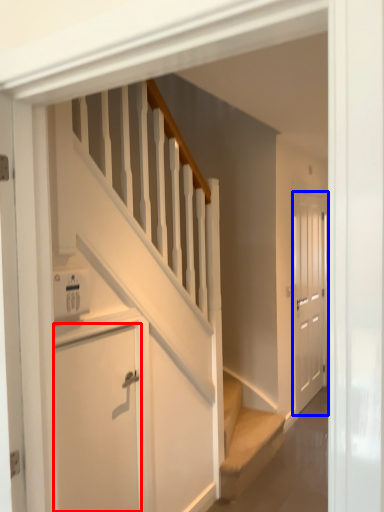
Question: Which object is further to the camera taking this photo, door (highlighted by a red box) or door (highlighted by a blue box)?

Choices:
 (A) door
 (B) door

Answer: (B)